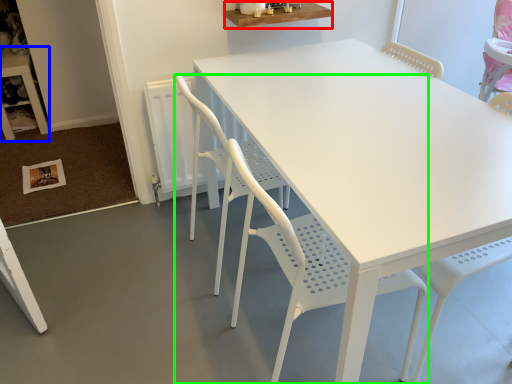
Question: Based on their relative distances, which object is farther from table (highlighted by a red box)? Choose from table (highlighted by a blue box) and chair (highlighted by a green box).

Choices:
 (A) table
 (B) chair

Answer: (A)